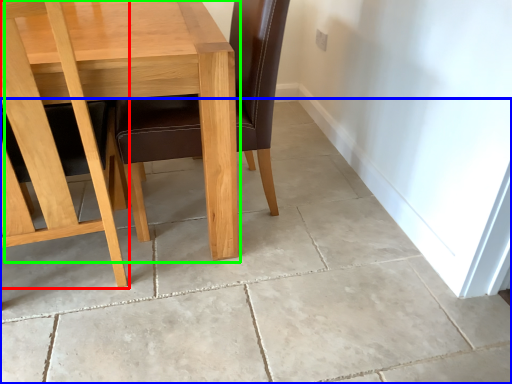
Question: Which object is the farthest from chair (highlighted by a red box)? Choose among these: concrete (highlighted by a blue box) or table (highlighted by a green box).

Choices:
 (A) concrete
 (B) table

Answer: (A)